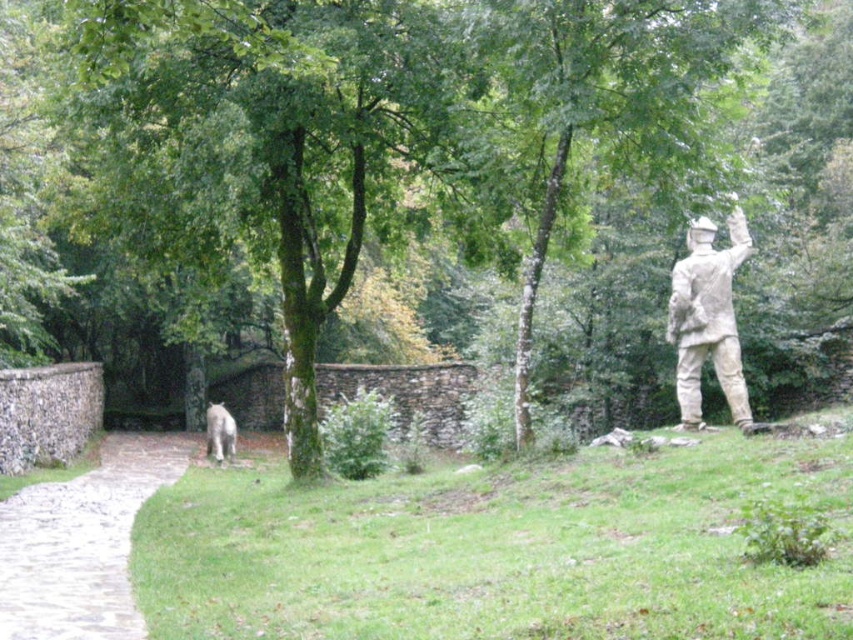
You are standing at the base of the statue and want to reach the stone wall behind the green grassy at lower center. If the statue is 10 feet tall, can you see the top of the statue from your current position?

The green grassy at lower center is 18.27 feet away from you. Since the statue is 10 feet tall, you can see the top of the statue from your current position because the distance is not obstructed by the grassy area.

Based on the photo, you are standing at the entrance of a garden and see the cobblestone path at lower left and the stone statue at right. Which object is closer to the ground?

The cobblestone path at lower left is closer to the ground since it is positioned below the stone statue at right.

You are a tourist visiting the statue and want to take a photo of the cobblestone path at lower left and the white fur dog at lower left. Which object is closer to the camera?

The cobblestone path at lower left is not as tall as the white fur dog at lower left, so the white fur dog at lower left is closer to the camera.